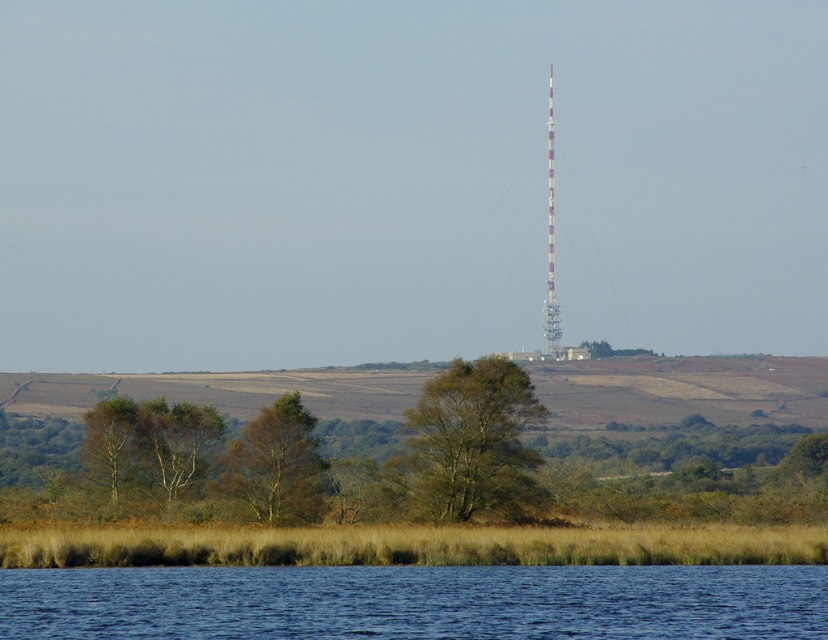
Question: Is green rough bark tree at center wider than brown textured tree at lower center?

Choices:
 (A) yes
 (B) no

Answer: (A)

Question: Can you confirm if brown textured tree at lower center is wider than white striped tower at center?

Choices:
 (A) yes
 (B) no

Answer: (B)

Question: Which point appears closest to the camera in this image?

Choices:
 (A) (111, 480)
 (B) (193, 445)

Answer: (A)

Question: Which of the following is the farthest from the observer?

Choices:
 (A) (549, 196)
 (B) (133, 433)
 (C) (427, 612)
 (D) (774, 445)

Answer: (A)

Question: Is blue liquid water at lower center to the left of green rough bark tree at center from the viewer's perspective?

Choices:
 (A) yes
 (B) no

Answer: (A)

Question: Which point is closer to the camera?

Choices:
 (A) (193, 408)
 (B) (318, 508)

Answer: (B)